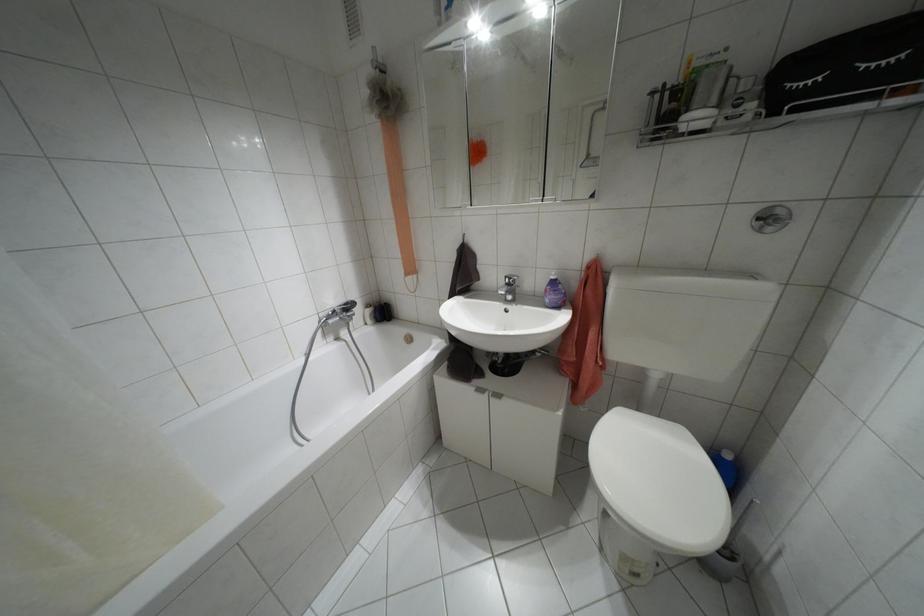
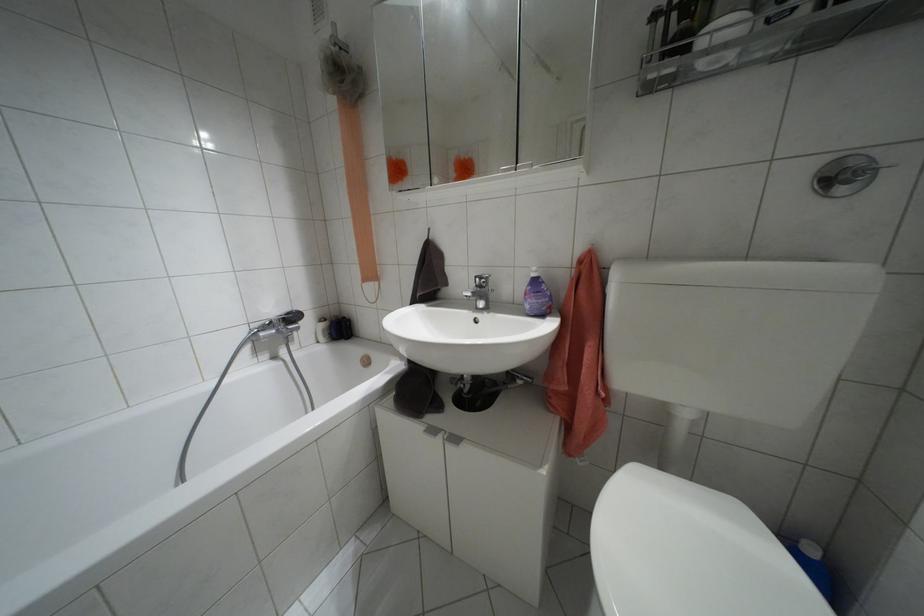
The point at (x=552, y=277) is marked in the first image. Where is the corresponding point in the second image?

(532, 274)